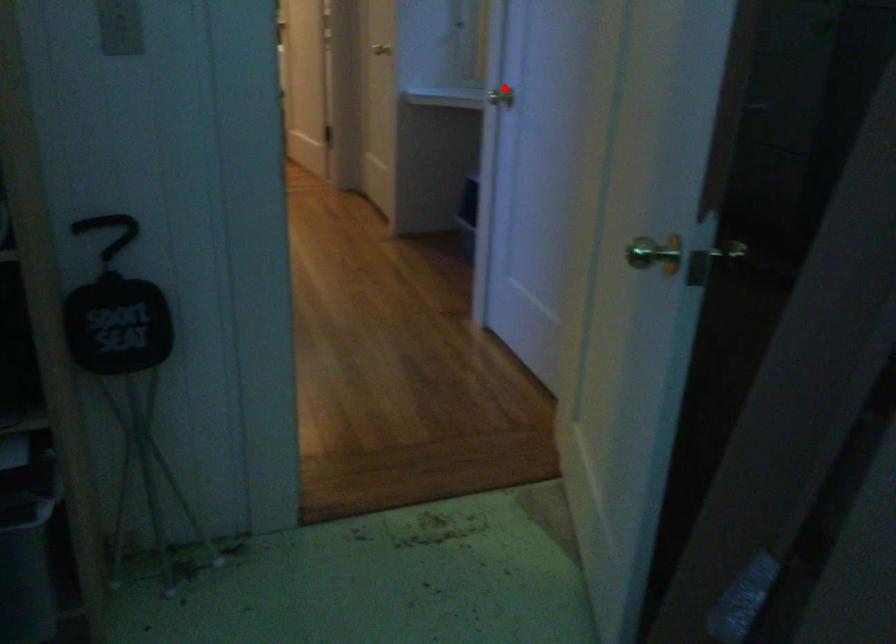
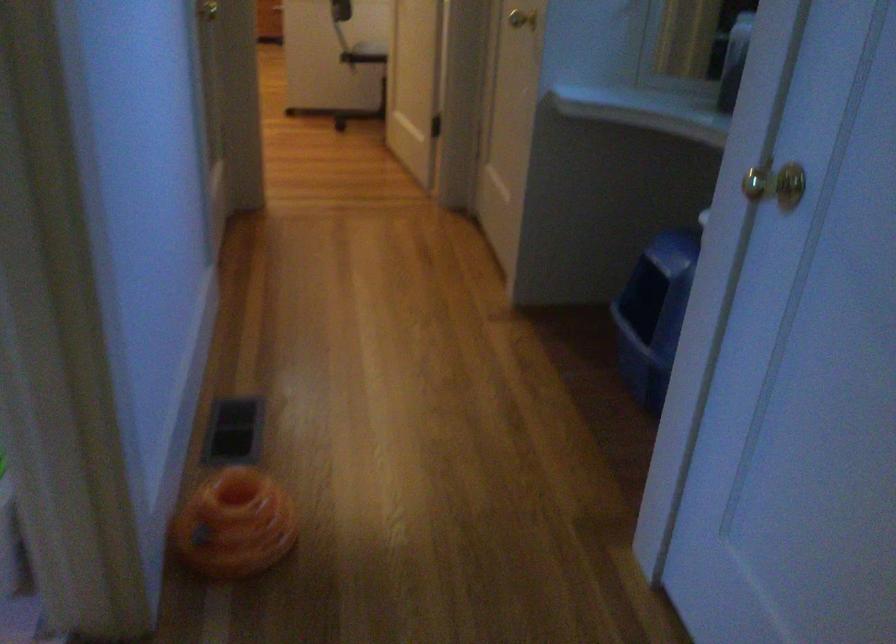
Question: I am providing you with two images of the same scene from different viewpoints. Given a red point in image1, look at the same physical point in image2. Is it:

Choices:
 (A) Closer to the viewpoint
 (B) Farther from the viewpoint

Answer: (A)